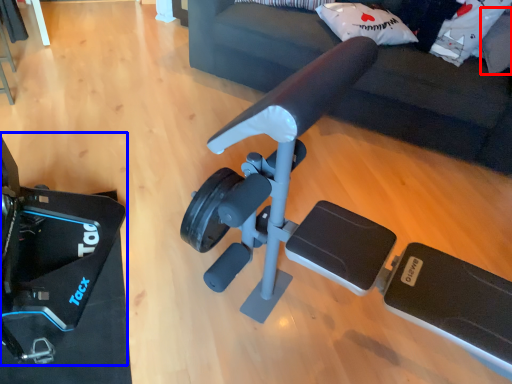
Question: Which object appears farthest to the camera in this image, pillow (highlighted by a red box) or video camera (highlighted by a blue box)?

Choices:
 (A) pillow
 (B) video camera

Answer: (A)